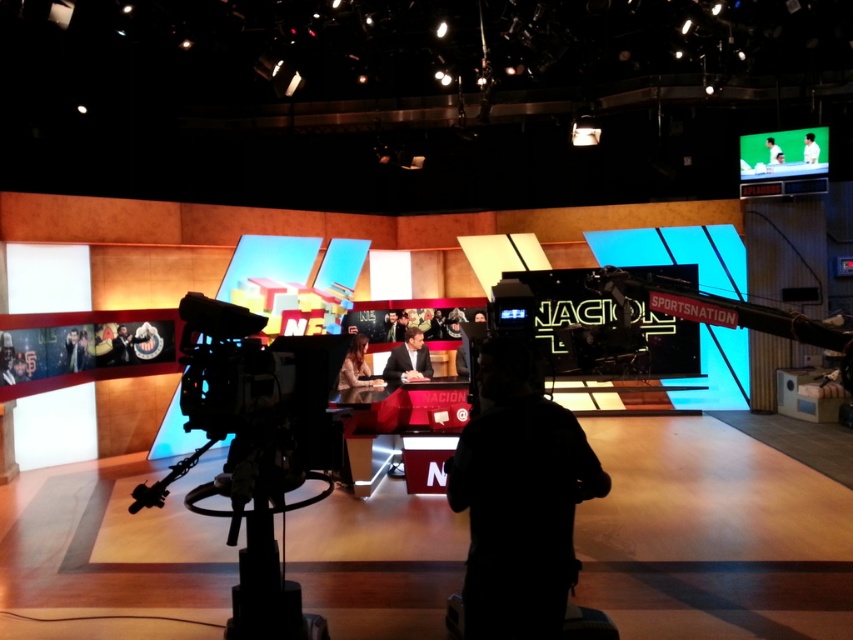
Which is behind, point (386, 372) or point (77, 365)?

The point (386, 372) is behind.

Does dark suit at center have a greater width compared to smooth black suit at lower left?

Yes, dark suit at center is wider than smooth black suit at lower left.

What are the coordinates of `dark suit at center` in the screenshot? It's located at click(408, 358).

Can you confirm if black matte video camera at left is bigger than smooth skin face at center?

Indeed, black matte video camera at left has a larger size compared to smooth skin face at center.

Is point (238, 556) positioned in front of point (361, 349)?

Yes, it is.

The image size is (853, 640). Describe the element at coordinates (256, 448) in the screenshot. I see `black matte video camera at left` at that location.

The image size is (853, 640). Find the location of `black matte video camera at left`. black matte video camera at left is located at coordinates (256, 448).

Does black matte person at center appear under smooth black suit at lower left?

Indeed, black matte person at center is positioned under smooth black suit at lower left.

Between black matte person at center and smooth black suit at lower left, which one is positioned lower?

black matte person at center

This screenshot has width=853, height=640. I want to click on black matte person at center, so click(x=518, y=500).

I want to click on black matte person at center, so click(518, 500).